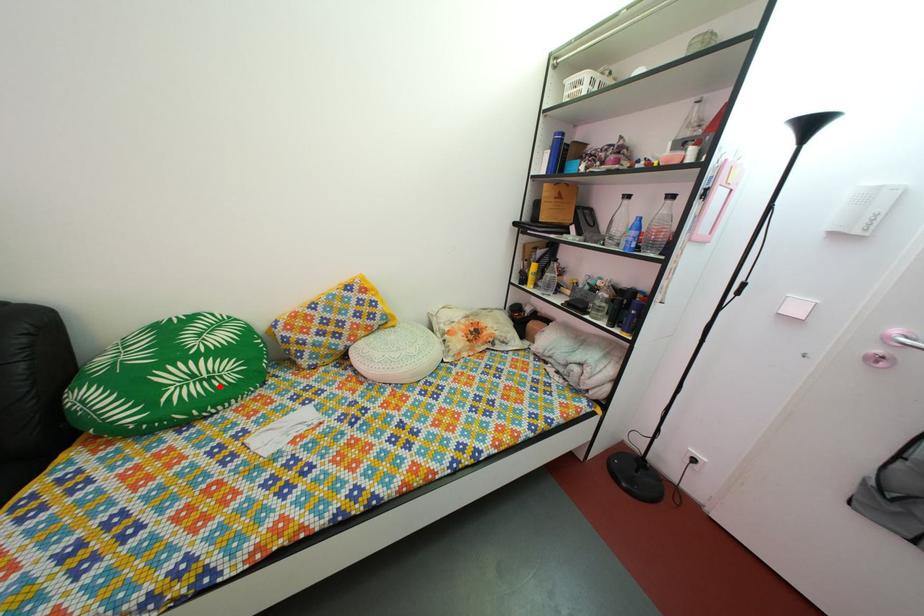
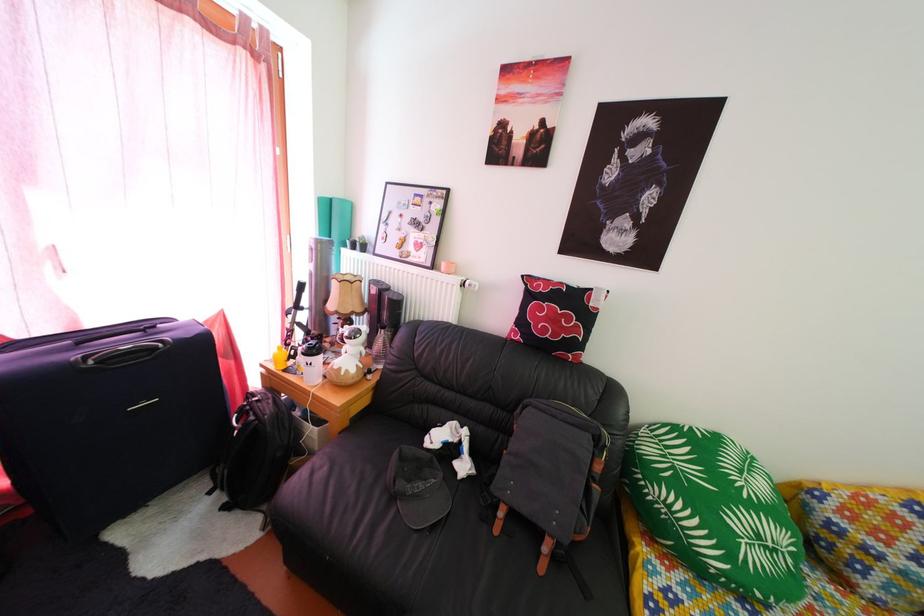
Question: I am providing you with two images of the same scene from different viewpoints. Given a red point in image1, look at the same physical point in image2. Is it:

Choices:
 (A) Closer to the viewpoint
 (B) Farther from the viewpoint

Answer: (A)